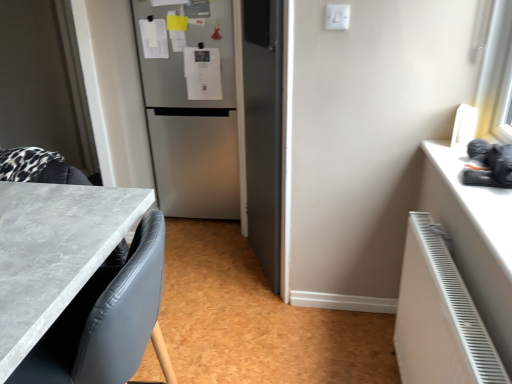
At what (x,y) coordinates should I click in order to perform the action: click on blank space situated above white matte radiator at lower right (from a real-world perspective). Please return your answer as a coordinate pair (x, y). This screenshot has width=512, height=384. Looking at the image, I should click on (443, 266).